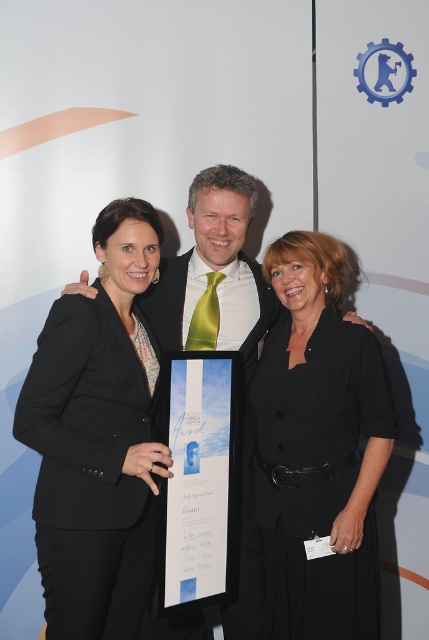
You are a photographer at the award ceremony. You need to adjust the lighting so that the black suit at left and the green satin tie at center are both well illuminated. Which object should you focus the light on first to ensure both are properly lit?

The black suit at left is located below green satin tie at center. Since the green satin tie at center is higher up, you should focus the light on the green satin tie at center first to ensure it and the lower black suit at left are both illuminated properly.

You are a photographer setting up for an awards ceremony photo. You need to ensure that the black matte dress at center and the green satin tie at center are both visible in the frame. Based on their widths, which one might require more careful positioning to avoid being cut off?

The green satin tie at center is wider than the black matte dress at center, so it might require more careful positioning to avoid being cut off.